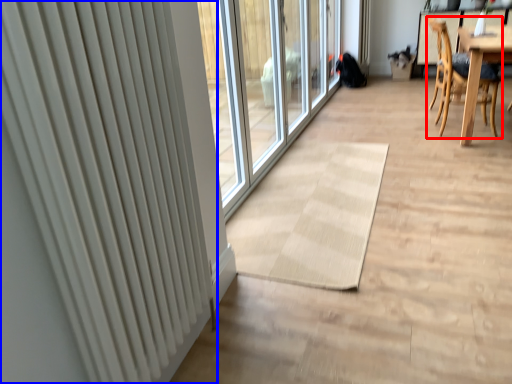
Question: Which object is further to the camera taking this photo, chair (highlighted by a red box) or radiator (highlighted by a blue box)?

Choices:
 (A) chair
 (B) radiator

Answer: (A)